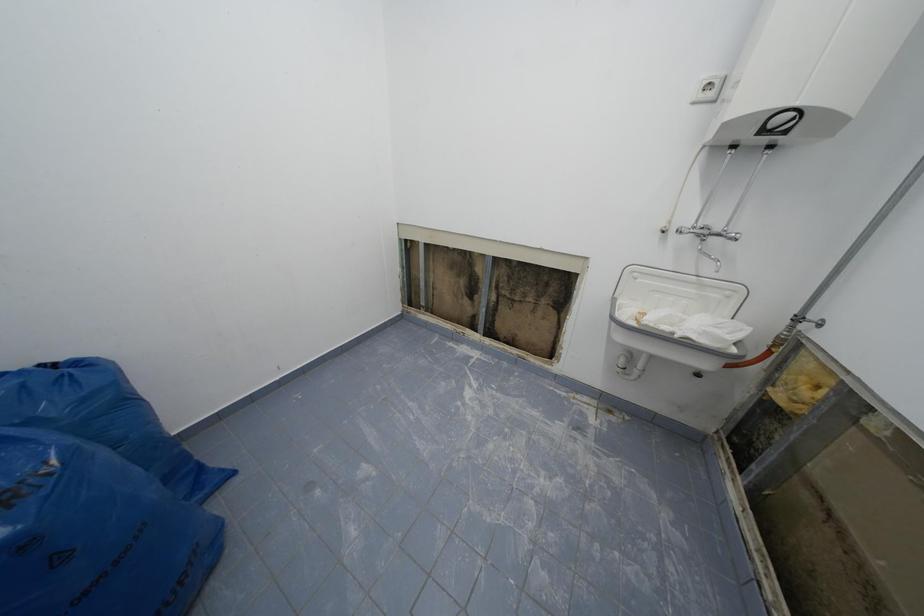
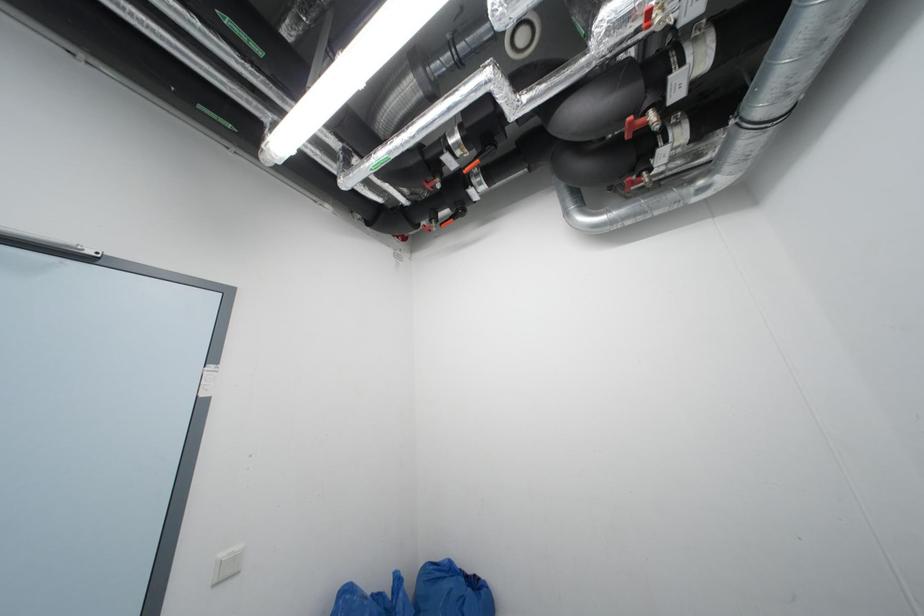
First-person continuous shooting, in which direction is the camera rotating?

The camera's rotation is toward left-up.